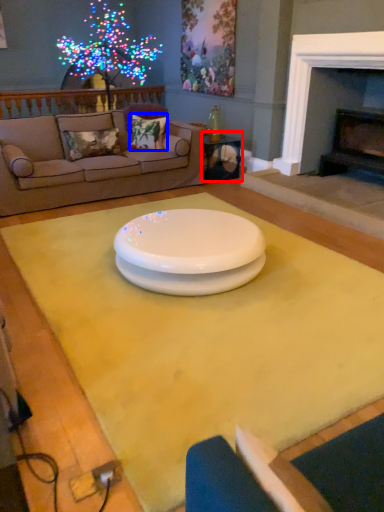
Question: Which object appears farthest to the camera in this image, table (highlighted by a red box) or pillow (highlighted by a blue box)?

Choices:
 (A) table
 (B) pillow

Answer: (A)